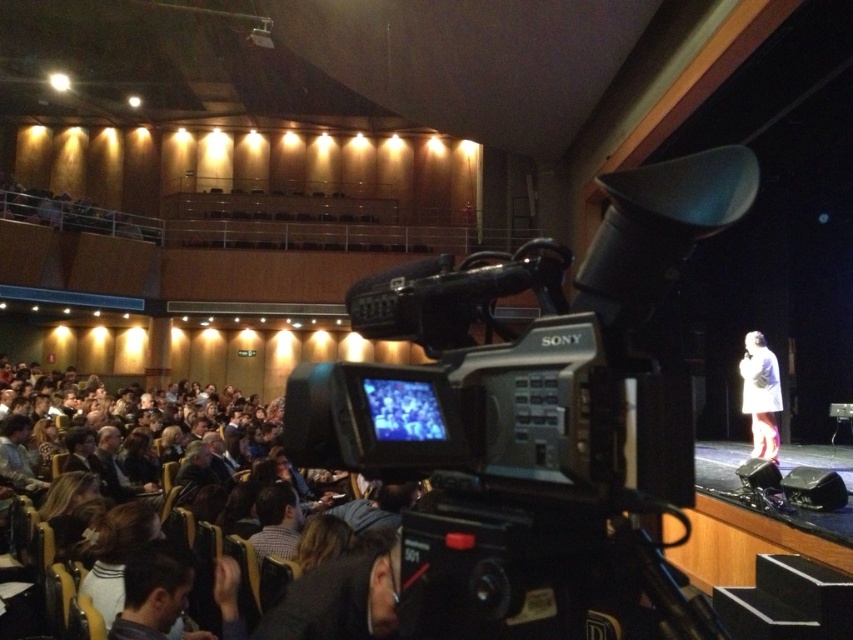
You are an event organizer who needs to adjust the camera angle to focus on the speaker. Since the black plastic video camera at center is positioned over the white matte coat at stage right, will adjusting the camera downward allow you to capture the speaker more clearly?

Yes, adjusting the camera downward will allow you to capture the speaker more clearly because the black plastic video camera at center is positioned over the white matte coat at stage right, meaning the camera is above the speaker and needs to be lowered to focus on them.